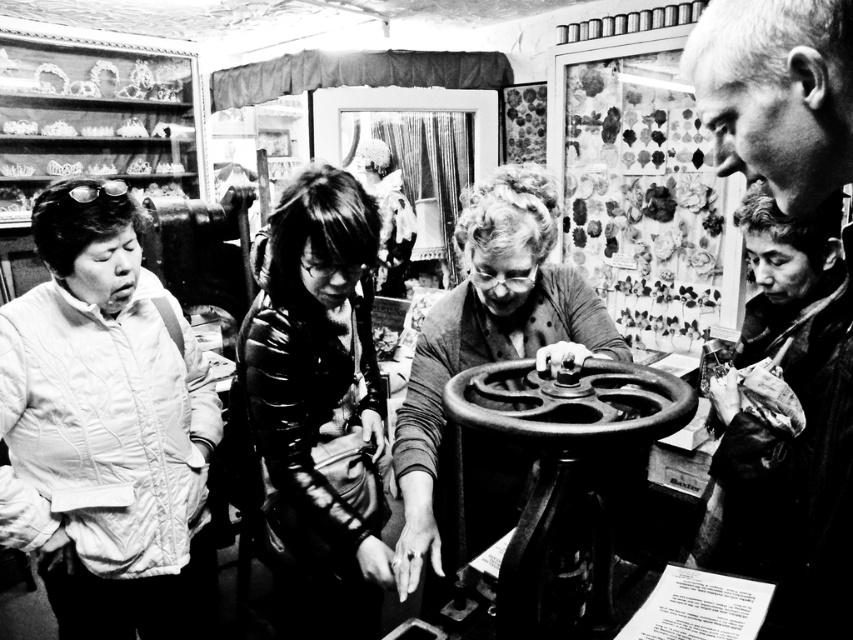
You are standing in front of the vintage sewing machine and notice two points marked in the scene. The first point is at coordinates point [138,298] and the second is at point [334,340]. From your perspective, which point is closer to you?

Point [334,340] is closer to you because the description states that point [138,298] is behind point [334,340].

You are a tailor trying to decide which jacket to place on a narrow display stand. Based on the image, which jacket between the quilted white jacket at left and the glossy black jacket at center would you choose to ensure it fits properly?

The glossy black jacket at center should be chosen because the quilted white jacket at left might be wider than the glossy black jacket at center, making it less likely to fit on the narrow display stand.

You are a technician who needs to repair the smooth black sewing machine at center and the metallic gear at center. You have a tool that can only reach up to 5 inches. Can you repair both without moving them?

The distance between the smooth black sewing machine at center and the metallic gear at center is 5.60 inches, which is longer than the tool can reach. Therefore, you cannot repair both without moving them.